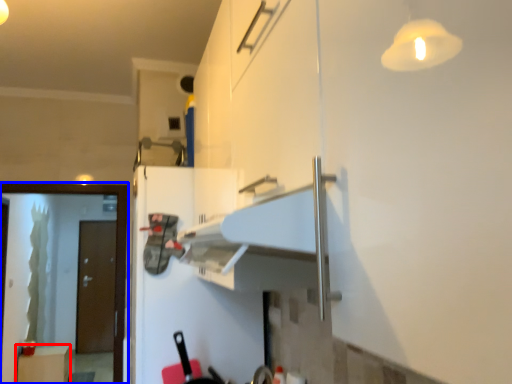
Question: Which point is further to the camera, cabinetry (highlighted by a red box) or screen door (highlighted by a blue box)?

Choices:
 (A) cabinetry
 (B) screen door

Answer: (A)